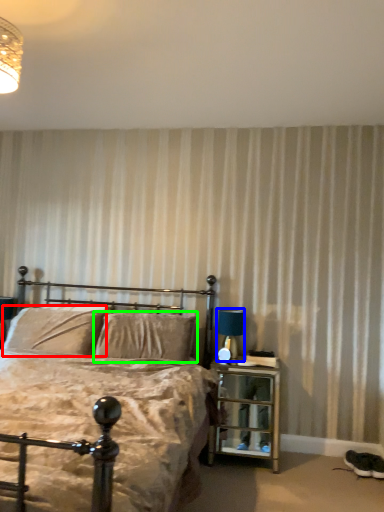
Question: Estimate the real-world distances between objects in this image. Which object is farther from pillow (highlighted by a red box), table lamp (highlighted by a blue box) or pillow (highlighted by a green box)?

Choices:
 (A) table lamp
 (B) pillow

Answer: (A)